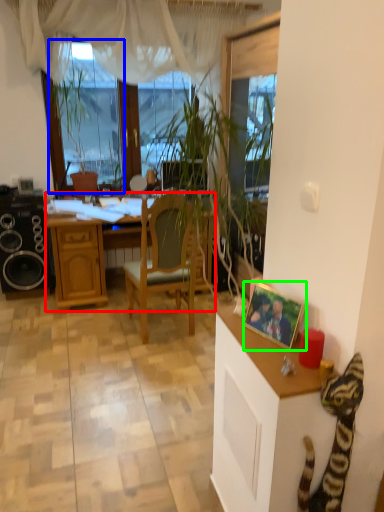
Question: Estimate the real-world distances between objects in this image. Which object is closer to desk (highlighted by a red box), window screen (highlighted by a blue box) or picture frame (highlighted by a green box)?

Choices:
 (A) window screen
 (B) picture frame

Answer: (A)